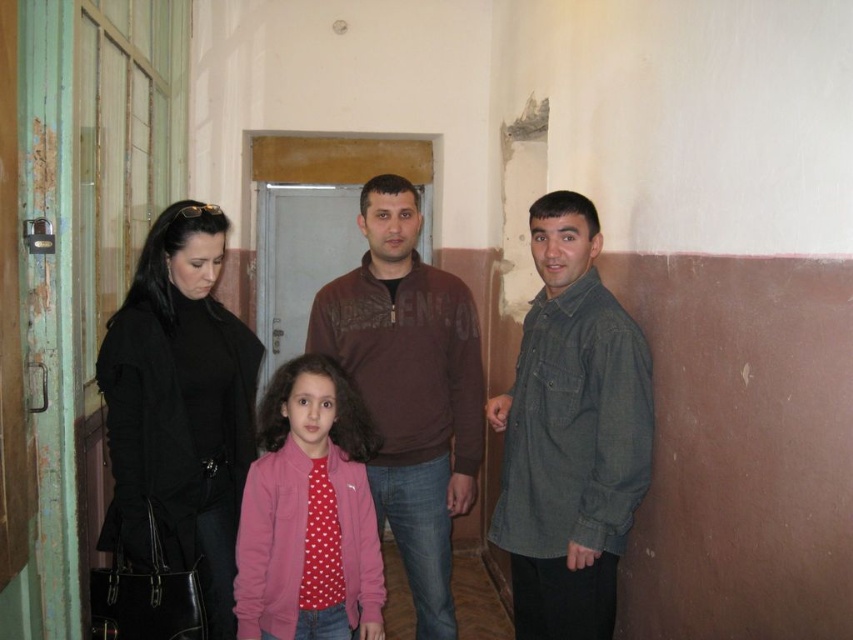
Is brown zip-up sweater at center bigger than pink fleece jacket at center?

Correct, brown zip-up sweater at center is larger in size than pink fleece jacket at center.

Does point (386, 214) lie in front of point (270, 561)?

No, (386, 214) is further to viewer.

The image size is (853, 640). What do you see at coordinates (409, 387) in the screenshot?
I see `brown zip-up sweater at center` at bounding box center [409, 387].

At what (x,y) coordinates should I click in order to perform the action: click on brown zip-up sweater at center. Please return your answer as a coordinate pair (x, y). Image resolution: width=853 pixels, height=640 pixels. Looking at the image, I should click on (409, 387).

Does point (148, 429) lie in front of point (368, 428)?

Yes, point (148, 429) is in front of point (368, 428).

Identify the location of black matte coat at left. This screenshot has width=853, height=640. (180, 408).

Between dark green shirt at right and pink fleece jacket at center, which one has more height?

dark green shirt at right is taller.

Looking at this image, which is more to the right, dark green shirt at right or pink fleece jacket at center?

dark green shirt at right

Between point (606, 480) and point (334, 524), which one is positioned behind?

The point (334, 524) is more distant.

Locate an element on the screen. The width and height of the screenshot is (853, 640). dark green shirt at right is located at coordinates (570, 433).